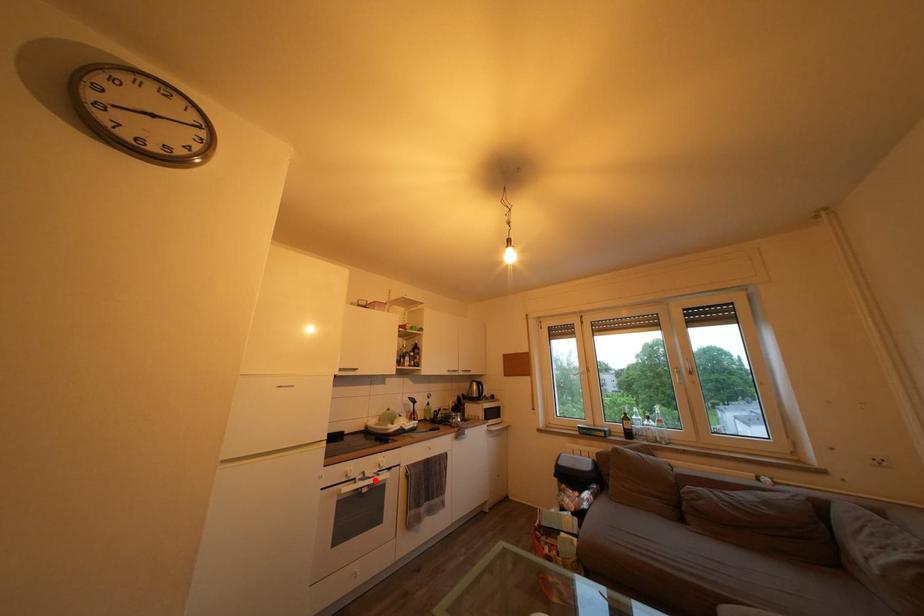
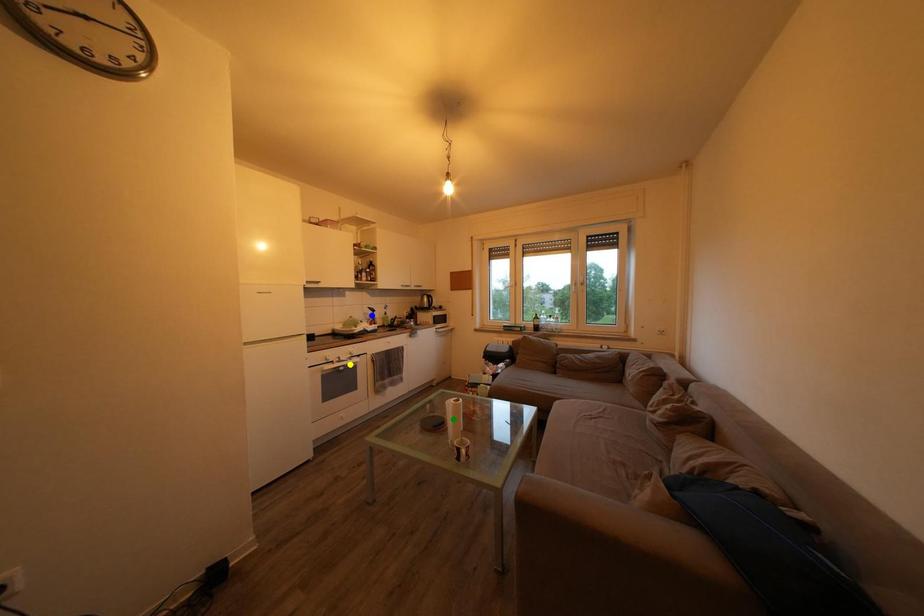
Question: I am providing you with two images of the same scene from different viewpoints. A red point is marked on the first image. You are given multiple points on the second image. In image 2, which mark is for the same physical point as the one in image 1?

Choices:
 (A) yellow point
 (B) green point
 (C) blue point

Answer: (A)